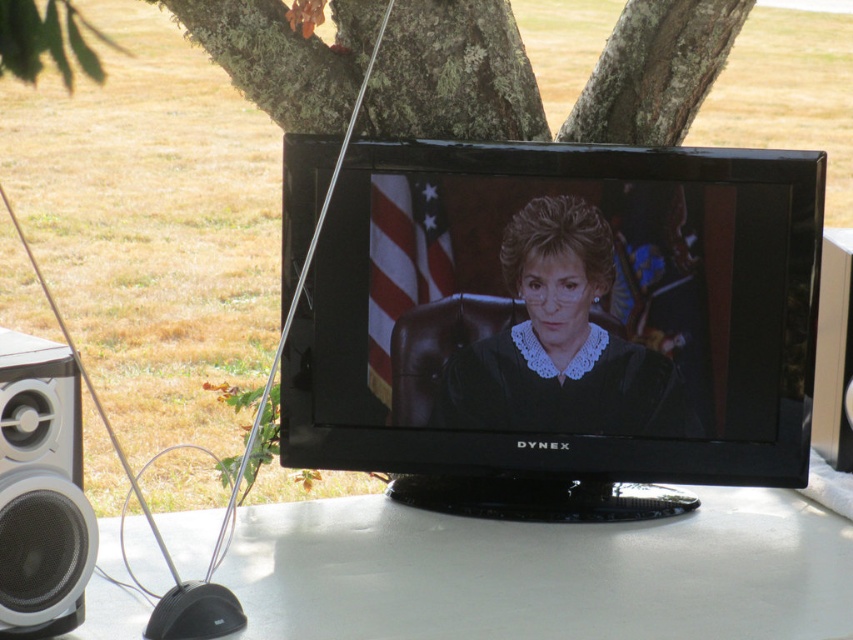
You are setting up a stereo system with two speakers. You have a white matte speaker at lower left and a black plastic speaker at lower left. Which speaker should you place on the left side of the TV to ensure proper stereo placement?

The white matte speaker at lower left should be placed on the left side of the TV because it is larger and typically larger speakers are used for better sound quality in stereo setups.

You are setting up a portable speaker system for an outdoor event. You have a black glossy tv at center and a black plastic speaker at lower left. Which object has a larger width?

The black glossy tv at center has a larger width than the black plastic speaker at lower left according to the description.